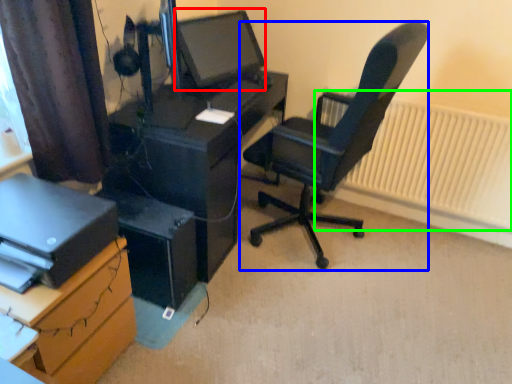
Question: Considering the real-world distances, which object is farthest from computer monitor (highlighted by a red box)? chair (highlighted by a blue box) or radiator (highlighted by a green box)?

Choices:
 (A) chair
 (B) radiator

Answer: (B)